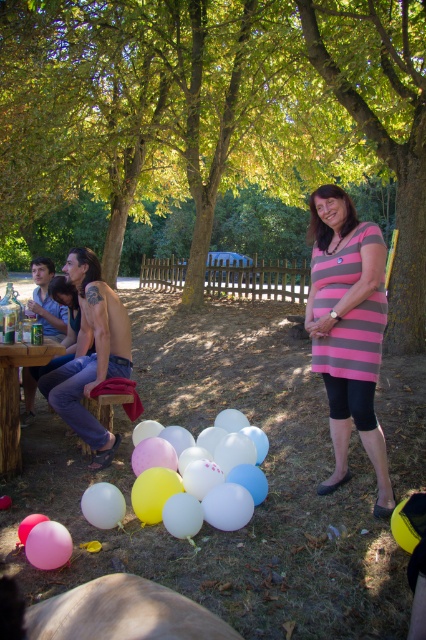
Can you confirm if pastel balloons at lower center is positioned below pink rubber balloon at lower left?

No, pastel balloons at lower center is not below pink rubber balloon at lower left.

Can you confirm if pastel balloons at lower center is positioned to the right of pink rubber balloon at lower left?

Correct, you'll find pastel balloons at lower center to the right of pink rubber balloon at lower left.

Where is `pastel balloons at lower center`? pastel balloons at lower center is located at coordinates (204, 486).

Between green leafy tree at upper center and pink rubber balloon at lower left, which one is positioned higher?

green leafy tree at upper center is higher up.

Can you confirm if green leafy tree at upper center is taller than pink rubber balloon at lower left?

Indeed, green leafy tree at upper center has a greater height compared to pink rubber balloon at lower left.

Image resolution: width=426 pixels, height=640 pixels. Describe the element at coordinates (215, 112) in the screenshot. I see `green leafy tree at upper center` at that location.

Locate an element on the screen. green leafy tree at upper center is located at coordinates (215, 112).

Is pink striped dress at center thinner than white matte balloon at lower left?

In fact, pink striped dress at center might be wider than white matte balloon at lower left.

Is pink striped dress at center further to the viewer compared to white matte balloon at lower left?

Yes, pink striped dress at center is behind white matte balloon at lower left.

Locate an element on the screen. pink striped dress at center is located at coordinates (348, 330).